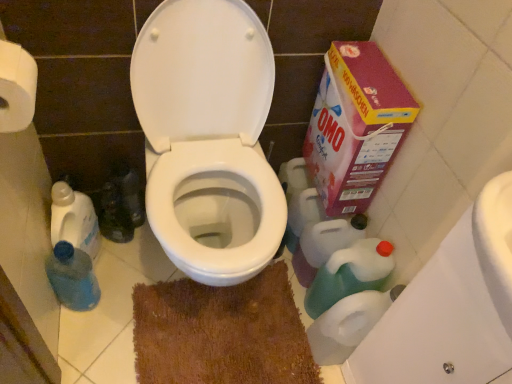
Question: From a real-world perspective, is blue plastic bottle at lower left, placed as the second cleaning product when sorted from right to left, over brown textured bath mat at center?

Choices:
 (A) yes
 (B) no

Answer: (A)

Question: Is blue plastic bottle at lower left, marked as the 2th cleaning product in a left-to-right arrangement, thinner than brown textured bath mat at center?

Choices:
 (A) no
 (B) yes

Answer: (B)

Question: From a real-world perspective, does blue plastic bottle at lower left, placed as the second cleaning product when sorted from right to left, sit lower than brown textured bath mat at center?

Choices:
 (A) yes
 (B) no

Answer: (B)

Question: Considering the relative sizes of blue plastic bottle at lower left, placed as the second cleaning product when sorted from right to left, and brown textured bath mat at center in the image provided, is blue plastic bottle at lower left, placed as the second cleaning product when sorted from right to left, taller than brown textured bath mat at center?

Choices:
 (A) yes
 (B) no

Answer: (A)

Question: Is blue plastic bottle at lower left, marked as the 2th cleaning product in a left-to-right arrangement, outside of brown textured bath mat at center?

Choices:
 (A) yes
 (B) no

Answer: (A)

Question: Does blue plastic bottle at lower left, placed as the second cleaning product when sorted from right to left, lie in front of brown textured bath mat at center?

Choices:
 (A) yes
 (B) no

Answer: (A)

Question: Considering the relative positions of brown textured bath mat at center and white paper towel at upper left, marked as the 2th toilet paper in a right-to-left arrangement, in the image provided, is brown textured bath mat at center to the left of white paper towel at upper left, marked as the 2th toilet paper in a right-to-left arrangement, from the viewer's perspective?

Choices:
 (A) yes
 (B) no

Answer: (B)

Question: Is brown textured bath mat at center taller than white paper towel at upper left, which ranks as the second toilet paper in bottom-to-top order?

Choices:
 (A) yes
 (B) no

Answer: (B)

Question: Are brown textured bath mat at center and white paper towel at upper left, marked as the 1th toilet paper in a front-to-back arrangement, located far from each other?

Choices:
 (A) no
 (B) yes

Answer: (A)

Question: Is brown textured bath mat at center positioned beyond the bounds of white paper towel at upper left, marked as the 2th toilet paper in a right-to-left arrangement?

Choices:
 (A) yes
 (B) no

Answer: (A)

Question: Is brown textured bath mat at center smaller than white paper towel at upper left, marked as the 2th toilet paper in a right-to-left arrangement?

Choices:
 (A) no
 (B) yes

Answer: (A)

Question: Does brown textured bath mat at center appear on the right side of white paper towel at upper left, marked as the 1th toilet paper in a left-to-right arrangement?

Choices:
 (A) no
 (B) yes

Answer: (B)

Question: Does white plastic toilet paper at lower right, marked as the second toilet paper in a top-to-bottom arrangement, have a greater height compared to blue plastic bottle at lower left, placed as the second cleaning product when sorted from right to left?

Choices:
 (A) no
 (B) yes

Answer: (B)